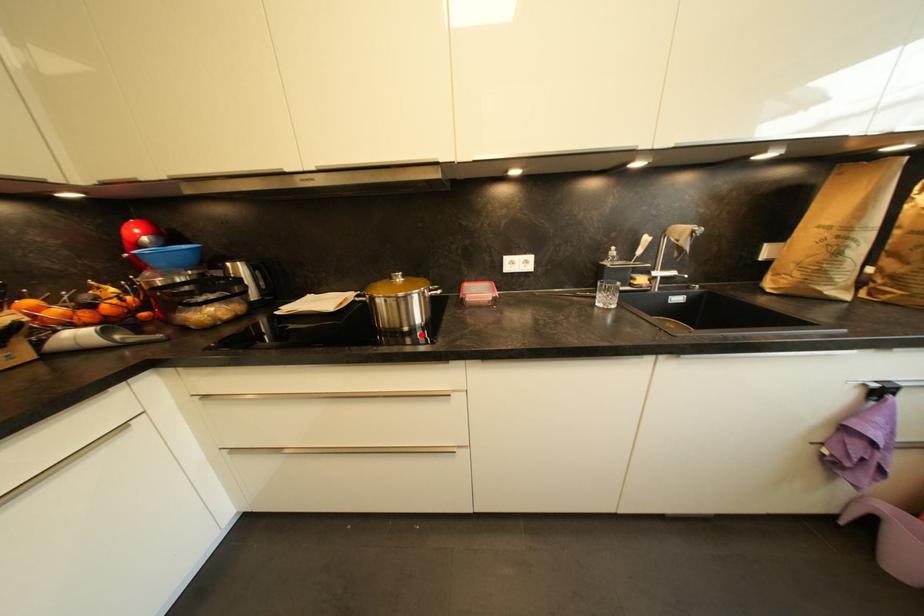
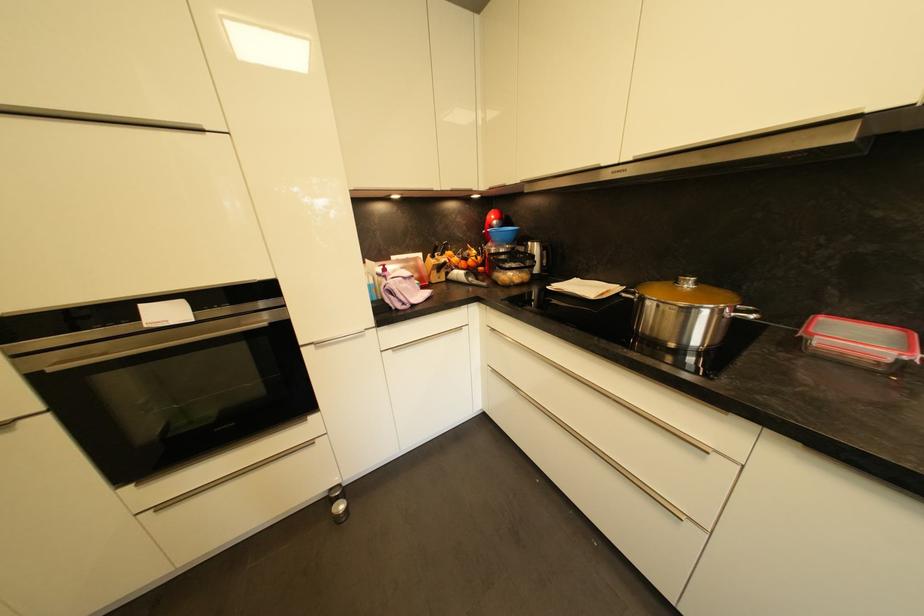
In the second image, find the point that corresponds to the highlighted location in the first image.

(690, 357)